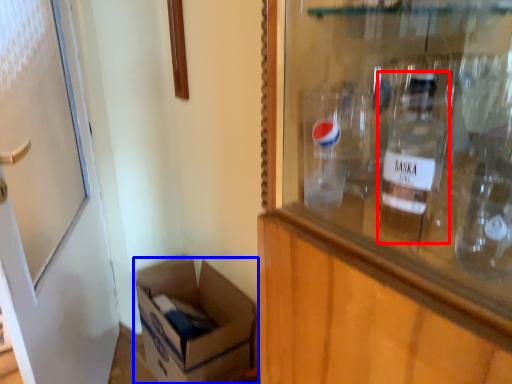
Question: Which point is further to the camera, bottle (highlighted by a red box) or box (highlighted by a blue box)?

Choices:
 (A) bottle
 (B) box

Answer: (B)